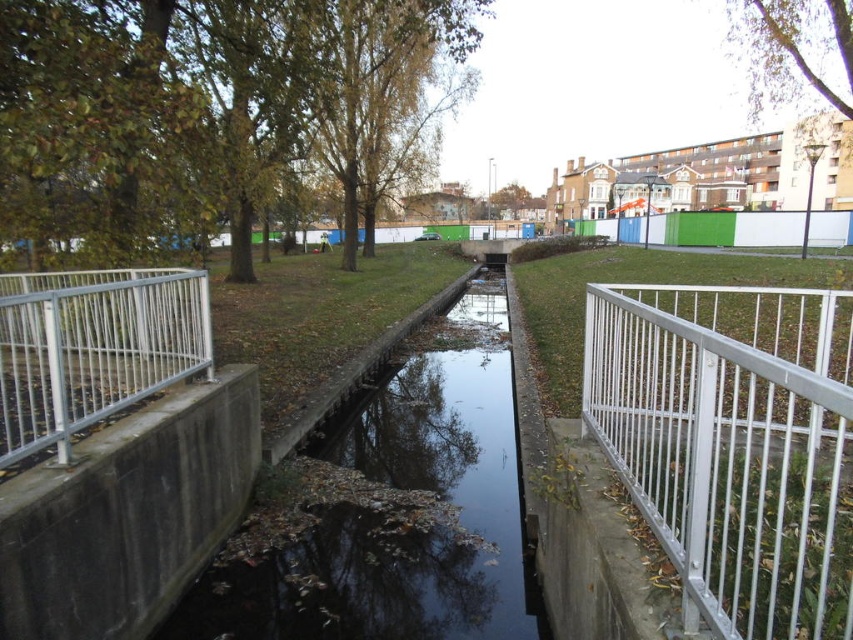
Is white metal fence at right shorter than black concrete stream at center?

No.

Is white metal fence at right taller than black concrete stream at center?

Correct, white metal fence at right is much taller as black concrete stream at center.

The height and width of the screenshot is (640, 853). What are the coordinates of `white metal fence at right` in the screenshot? It's located at (733, 444).

Which is more to the right, white metal fence at right or silver metallic fence at left?

white metal fence at right

Who is lower down, white metal fence at right or silver metallic fence at left?

Positioned lower is silver metallic fence at left.

Does point (582, 410) lie in front of point (129, 314)?

Yes.

Locate an element on the screen. This screenshot has height=640, width=853. white metal fence at right is located at coordinates (733, 444).

How much distance is there between white metal fence at right and green fabric fence at center?

white metal fence at right is 31.37 meters away from green fabric fence at center.

Is point (819, 442) behind point (698, 240)?

No, it is in front of (698, 240).

Where is `white metal fence at right`? This screenshot has width=853, height=640. white metal fence at right is located at coordinates (733, 444).